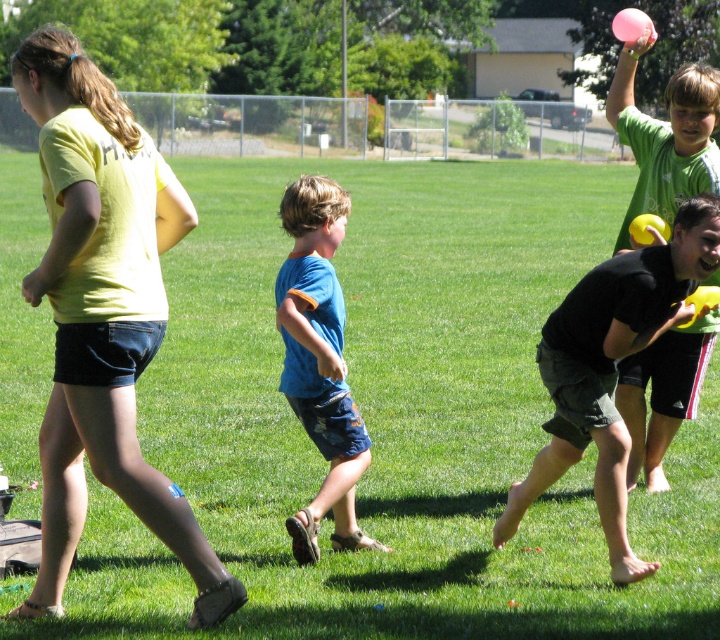
You are a photographer trying to capture a shot of the black matte shorts at right and the pink rubber ball at upper right. Based on their positions, which object would you focus on first to ensure both are in frame?

The black matte shorts at right is located below the pink rubber ball at upper right, so focusing on the pink rubber ball at upper right first would ensure both are within the frame since it is higher up.

You are a photographer trying to capture a photo of the yellow matte shirt at left and the blue cotton shorts at center. Which object should you focus on first to ensure both are in clear view?

The yellow matte shirt at left is closer to the viewer than the blue cotton shorts at center, so you should focus on the yellow matte shirt at left first to ensure both are in clear view.

Consider the image. You are standing at the point labeled point (325, 282) and want to throw a frisbee to a friend at point (112, 225). Considering the spatial relationship between these two points, which direction should you aim your throw?

Point (112, 225) is in front of point (325, 282), so you should aim your throw forward towards the direction of point (112, 225).